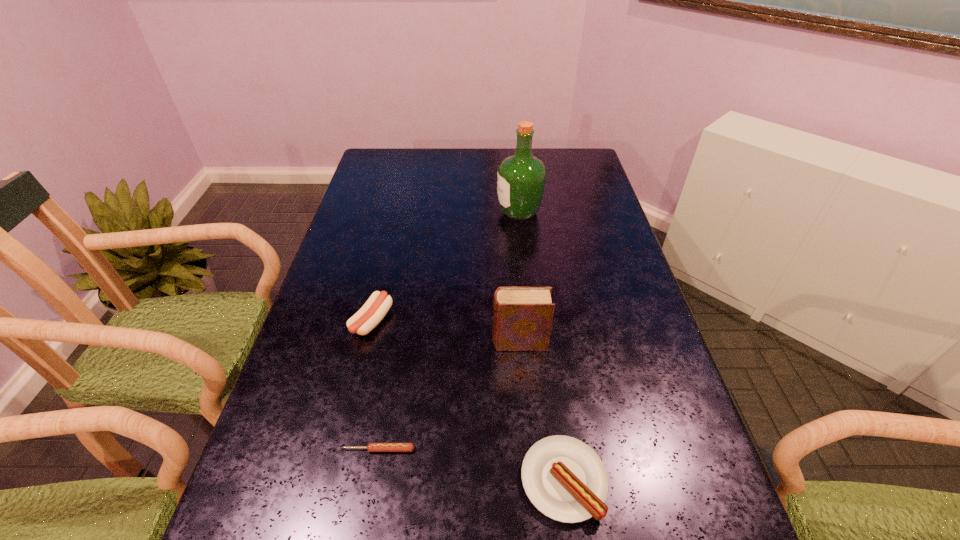
Find the location of a particular element. This screenshot has width=960, height=540. vacant space located on the front-facing side of the liquor is located at coordinates (x=424, y=212).

The width and height of the screenshot is (960, 540). Find the location of `free location located on the spine side of the second tallest object`. free location located on the spine side of the second tallest object is located at coordinates (459, 342).

Find the location of a particular element. The image size is (960, 540). free spot located on the spine side of the second tallest object is located at coordinates (459, 342).

What are the coordinates of `vacant point located 0.090m on the spine side of the second tallest object` in the screenshot? It's located at (454, 342).

At what (x,y) coordinates should I click in order to perform the action: click on vacant area located on the left of the farthest sausage. Please return your answer as a coordinate pair (x, y). Looking at the image, I should click on (328, 321).

Locate an element on the screen. The width and height of the screenshot is (960, 540). vacant space situated on the left of the rightmost sausage is located at coordinates (398, 480).

You are a GUI agent. You are given a task and a screenshot of the screen. Output one action in this format:
    pyautogui.click(x=<x>, y=<y>)
    Task: Click on the free space located on the right of the shortest object
    
    Given the screenshot: What is the action you would take?
    pyautogui.click(x=485, y=449)

Locate an element on the screen. object that is at the left edge is located at coordinates (376, 307).

Find the location of a particular element. This screenshot has width=960, height=540. blank area at the far edge is located at coordinates (551, 179).

The width and height of the screenshot is (960, 540). What are the coordinates of `vacant space at the left edge of the desktop` in the screenshot? It's located at (350, 360).